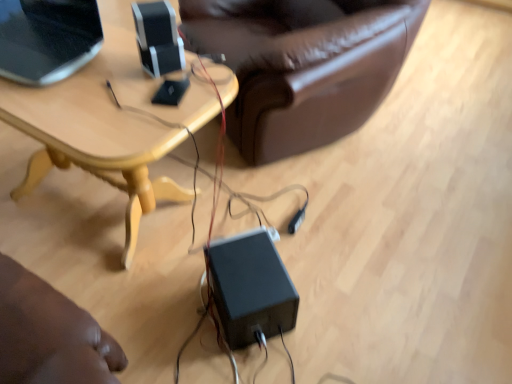
Image resolution: width=512 pixels, height=384 pixels. What are the coordinates of `free space above light wood table at center (from a real-world perspective)` in the screenshot? It's located at (97, 86).